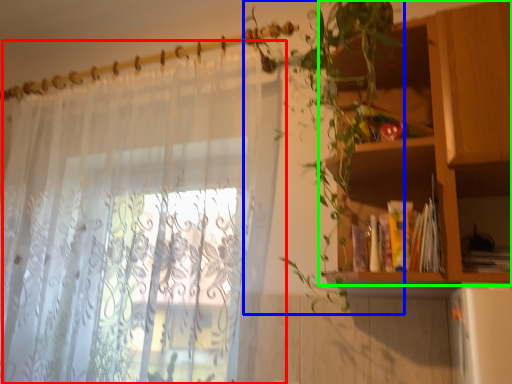
Question: Estimate the real-world distances between objects in this image. Which object is closer to curtain (highlighted by a red box), vegetation (highlighted by a blue box) or shelf (highlighted by a green box)?

Choices:
 (A) vegetation
 (B) shelf

Answer: (A)